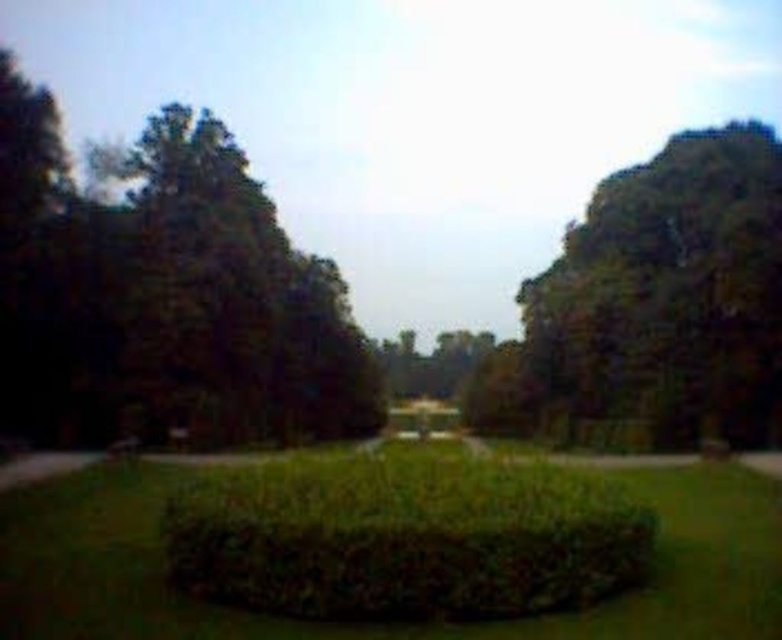
You are planning to plant a new tree in your garden. You have two options based on the image provided. The first option is the green leafy tree at left, and the second is the green leafy bush at center. If you want a plant with a narrower width, which one should you choose?

The green leafy tree at left is thinner than the green leafy bush at center, so you should choose the green leafy tree at left for a narrower width.